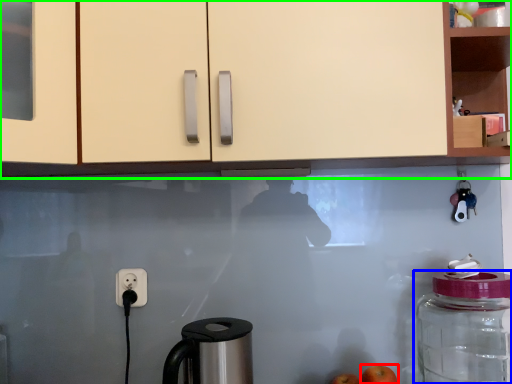
Question: Estimate the real-world distances between objects in this image. Which object is closer to apple (highlighted by a red box), bottle (highlighted by a blue box) or cabinetry (highlighted by a green box)?

Choices:
 (A) bottle
 (B) cabinetry

Answer: (A)